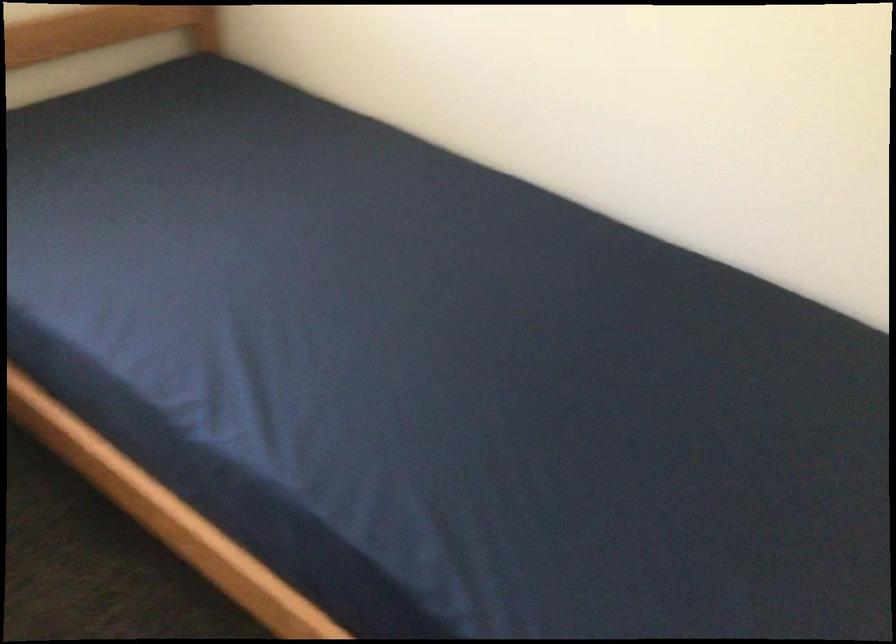
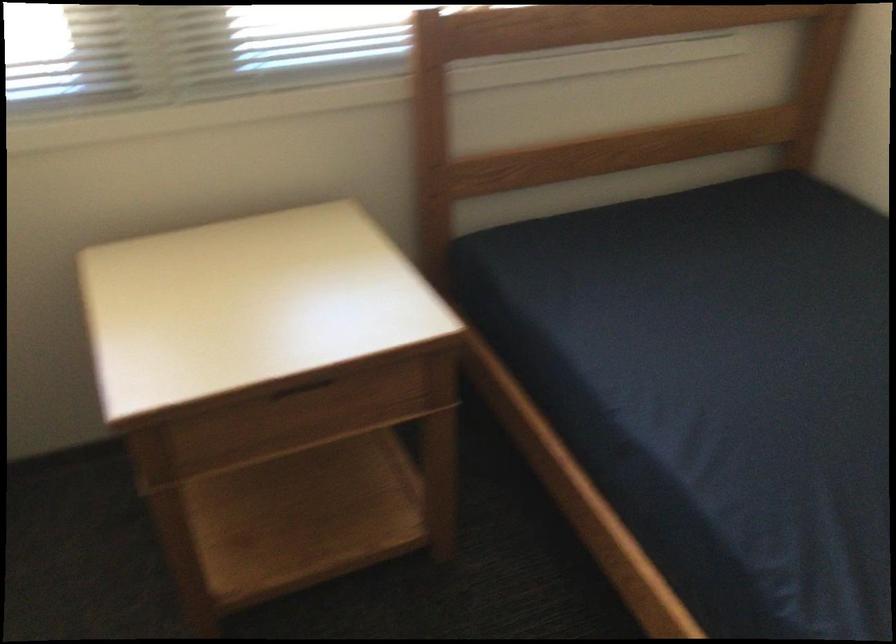
Question: The camera is either moving clockwise (left) or counter-clockwise (right) around the object. The first image is from the beginning of the video and the second image is from the end. Is the camera moving left or right when shooting the video?

Choices:
 (A) Left
 (B) Right

Answer: (B)